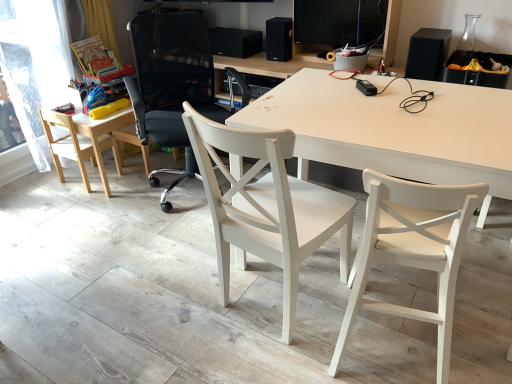
Locate an element on the screen. This screenshot has width=512, height=384. vacant area to the left of black mesh office chair at center, which is the third chair in right-to-left order is located at coordinates (100, 207).